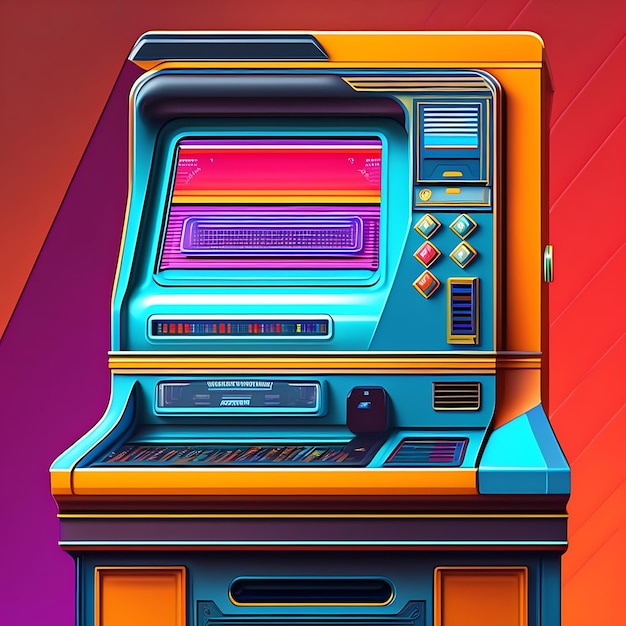
Locate an element on the screen. The image size is (626, 626). cabinet is located at coordinates (520, 183), (372, 42).